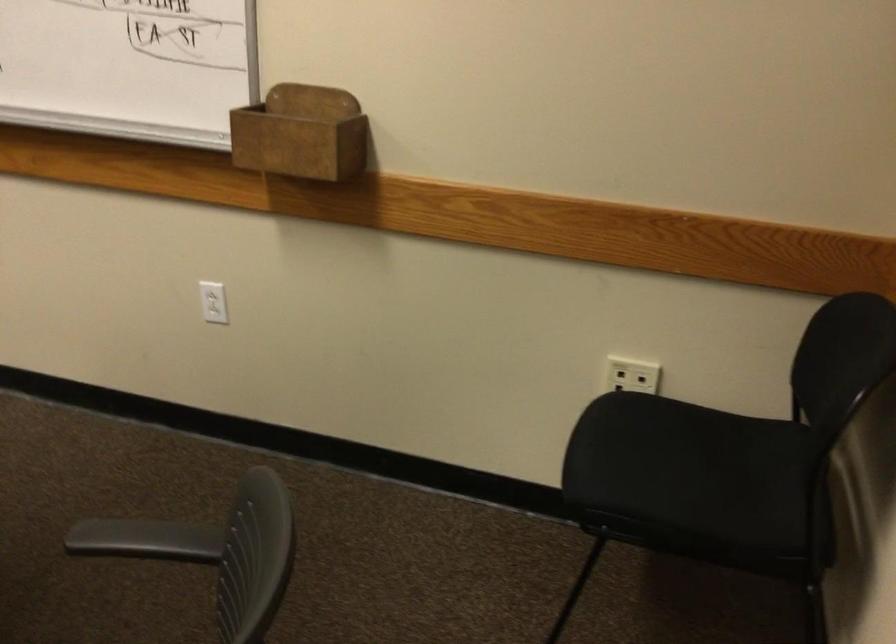
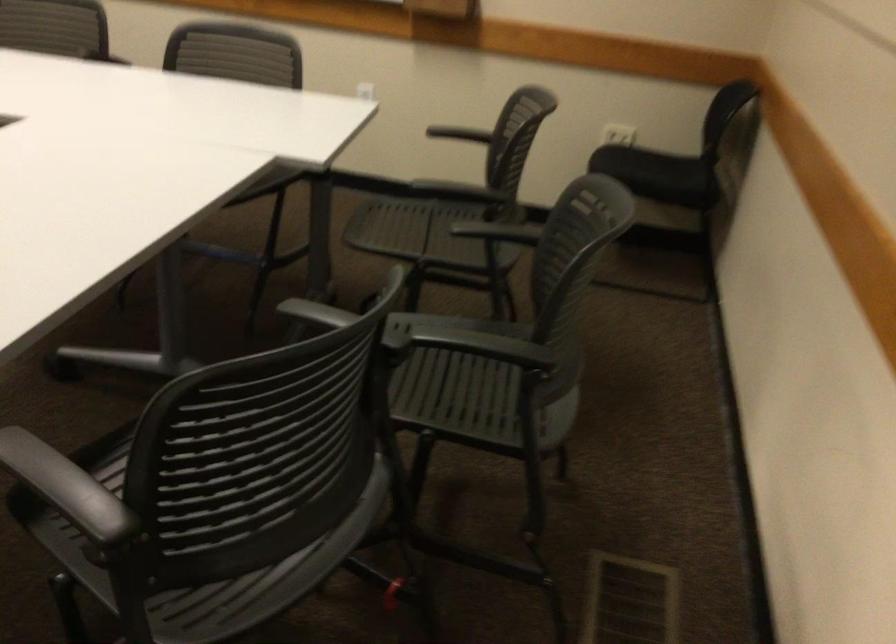
The point at (x=656, y=466) is marked in the first image. Where is the corresponding point in the second image?

(634, 166)